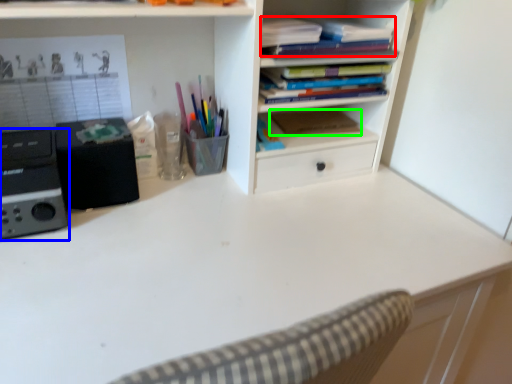
Question: Estimate the real-world distances between objects in this image. Which object is farther from book (highlighted by a red box), appliance (highlighted by a blue box) or paperback book (highlighted by a green box)?

Choices:
 (A) appliance
 (B) paperback book

Answer: (A)